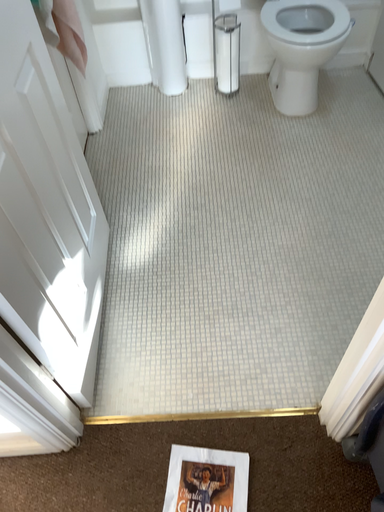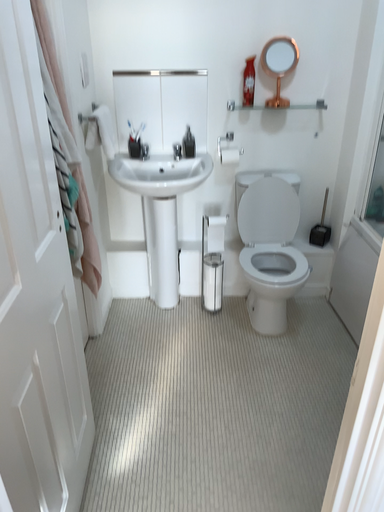
Question: How did the camera likely rotate when shooting the video?

Choices:
 (A) rotated upward
 (B) rotated downward

Answer: (A)